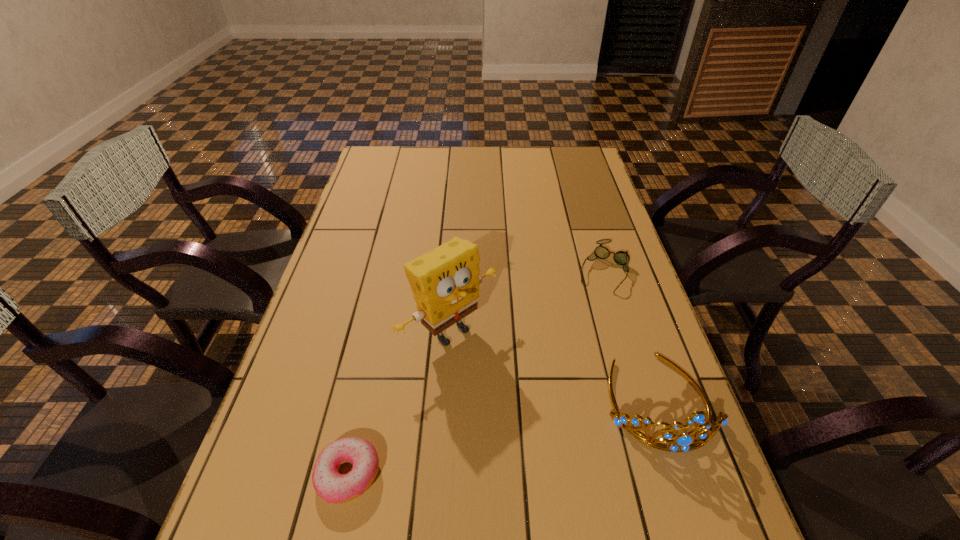
Where is `vacant space at the left edge of the desktop`? vacant space at the left edge of the desktop is located at coordinates (330, 317).

Identify the location of vacant region at the right edge. (682, 396).

Identify the location of vacant space at the far left corner. The width and height of the screenshot is (960, 540). (383, 161).

In the image, there is a desktop. Identify the location of free space at the near right corner. (686, 495).

Locate an element on the screen. vacant point located between the leftmost object and the second object from left to right is located at coordinates (399, 403).

This screenshot has width=960, height=540. I want to click on vacant area that lies between the tallest object and the tiara, so click(555, 367).

Where is `free spot between the third shortest object and the tallest object`? The image size is (960, 540). free spot between the third shortest object and the tallest object is located at coordinates (555, 367).

Locate an element on the screen. The height and width of the screenshot is (540, 960). free spot between the tiara and the leftmost object is located at coordinates (504, 438).

At what (x,y) coordinates should I click in order to perform the action: click on vacant area that lies between the third shortest object and the spectacles. Please return your answer as a coordinate pair (x, y). Looking at the image, I should click on (632, 335).

At what (x,y) coordinates should I click in order to perform the action: click on free spot between the doughnut and the third shortest object. Please return your answer as a coordinate pair (x, y). This screenshot has height=540, width=960. Looking at the image, I should click on (504, 438).